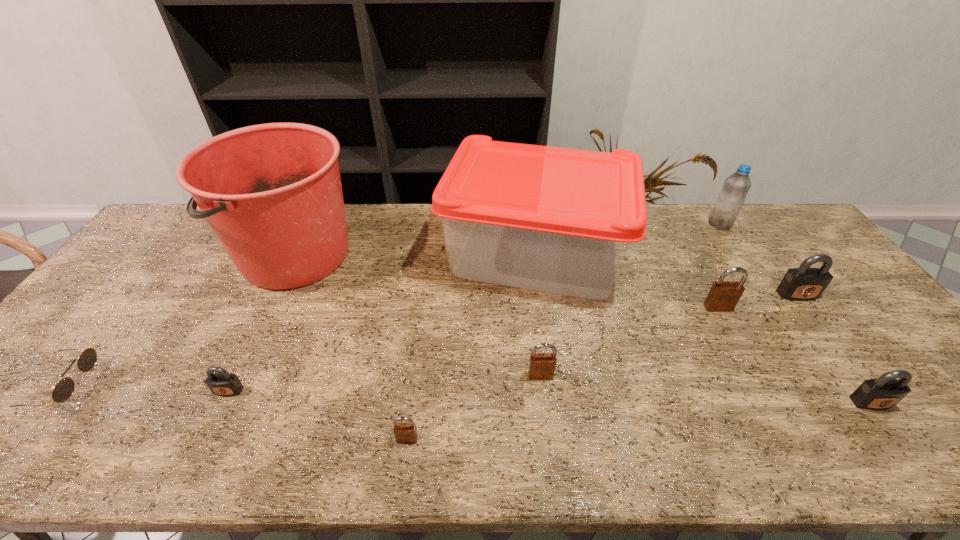
Identify the location of vacant space situated 0.120m on the front of the tray. The image size is (960, 540). pyautogui.click(x=548, y=346).

Locate an element on the screen. This screenshot has height=540, width=960. free space located on the left of the eighth shortest object is located at coordinates (619, 224).

Image resolution: width=960 pixels, height=540 pixels. I want to click on vacant region located 0.380m on the front of the farthest gray padlock near the keyhole, so click(x=894, y=426).

At what (x,y) coordinates should I click in order to perform the action: click on free region located 0.110m on the front-facing side of the fifth nearest padlock. Please return your answer as a coordinate pair (x, y). The height and width of the screenshot is (540, 960). Looking at the image, I should click on (737, 343).

The width and height of the screenshot is (960, 540). Find the location of `blank space located 0.140m on the front-facing side of the third padlock from left to right`. blank space located 0.140m on the front-facing side of the third padlock from left to right is located at coordinates (548, 434).

You are a GUI agent. You are given a task and a screenshot of the screen. Output one action in this format:
    pyautogui.click(x=<x>, y=<y>)
    Task: Click on the vacant point located 0.050m on the front of the second smallest gray padlock near the keyhole
    
    Given the screenshot: What is the action you would take?
    pyautogui.click(x=892, y=432)

Find the location of a particular element. This screenshot has width=960, height=540. free space located on the front of the leftmost gray padlock near the keyhole is located at coordinates (206, 438).

At what (x,y) coordinates should I click in order to perform the action: click on vacant space located on the front lenses of the shortest object. Please return your answer as a coordinate pair (x, y). The image size is (960, 540). Looking at the image, I should click on coord(118,387).

Find the location of `bucket that is positioned at the far edge`. bucket that is positioned at the far edge is located at coordinates (272, 193).

At what (x,y) coordinates should I click in order to perform the action: click on tray present at the far edge. Please return your answer as a coordinate pair (x, y). Looking at the image, I should click on (559, 220).